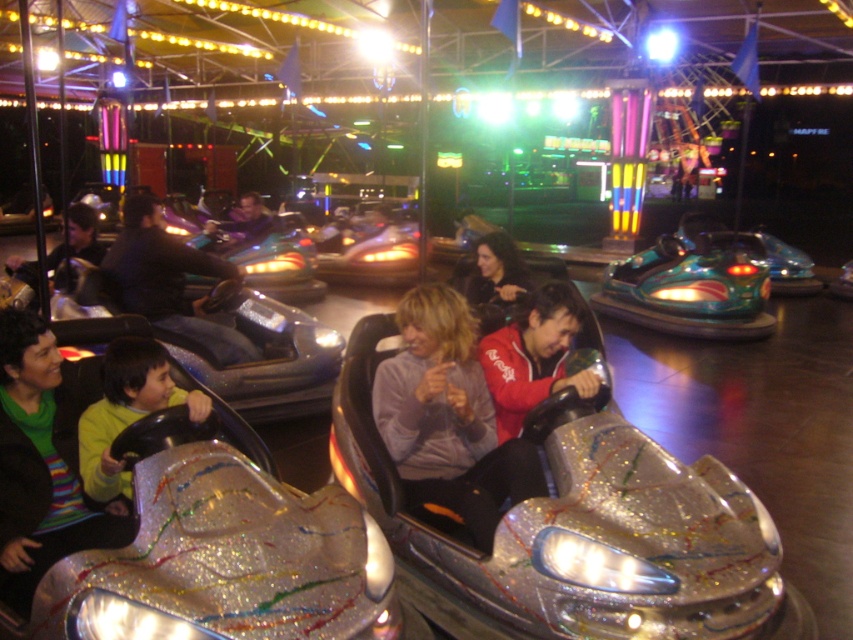
Question: Which object is closer to the camera taking this photo?

Choices:
 (A) green matte shirt at lower left
 (B) shiny silver helmet at center

Answer: (A)

Question: Is matte gray jacket at center above shiny silver helmet at center?

Choices:
 (A) no
 (B) yes

Answer: (A)

Question: Does green matte shirt at lower left have a lesser width compared to shiny silver helmet at center?

Choices:
 (A) yes
 (B) no

Answer: (A)

Question: Which point appears closest to the camera in this image?

Choices:
 (A) (231, 236)
 (B) (134, 294)
 (C) (518, 314)

Answer: (C)

Question: Is green matte shirt at lower left to the right of matte black jacket at left from the viewer's perspective?

Choices:
 (A) no
 (B) yes

Answer: (B)

Question: Which of the following is the closest to the observer?

Choices:
 (A) (469, 300)
 (B) (170, 385)

Answer: (B)